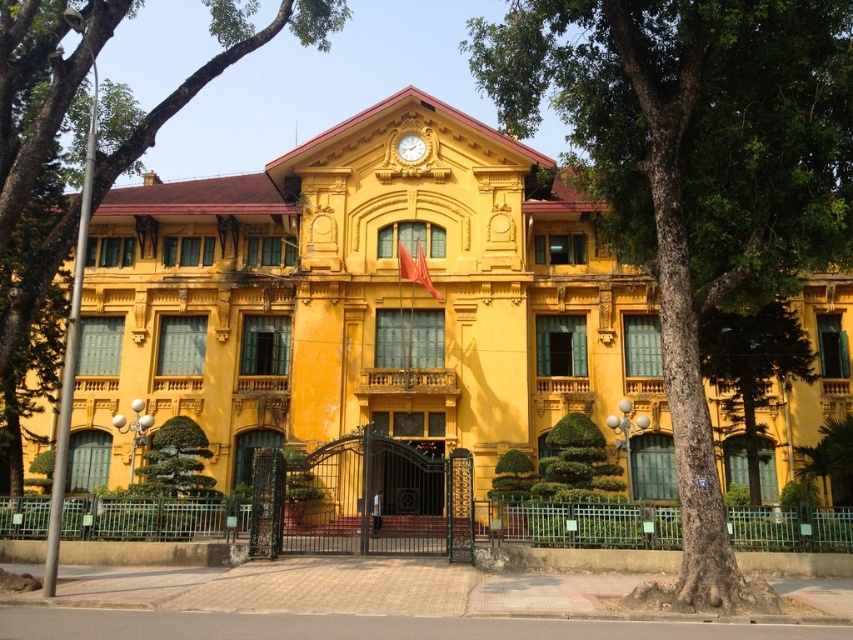
Question: Does green leafy tree at upper left have a larger size compared to gold textured clock at center?

Choices:
 (A) no
 (B) yes

Answer: (B)

Question: Does green textured tree at center have a lesser width compared to green textured tree at lower right?

Choices:
 (A) no
 (B) yes

Answer: (A)

Question: Among these objects, which one is farthest from the camera?

Choices:
 (A) gold textured clock at center
 (B) green textured tree at lower right
 (C) green leafy tree at upper left

Answer: (A)

Question: Which point is closer to the camera taking this photo?

Choices:
 (A) (59, 256)
 (B) (212, 195)
 (C) (726, 336)

Answer: (A)

Question: Is green leafy tree at upper left to the left of green textured tree at lower right from the viewer's perspective?

Choices:
 (A) yes
 (B) no

Answer: (A)

Question: Which object is positioned farthest from the green textured tree at lower right?

Choices:
 (A) green leafy tree at upper left
 (B) yellow matte building at center
 (C) gold textured clock at center

Answer: (A)